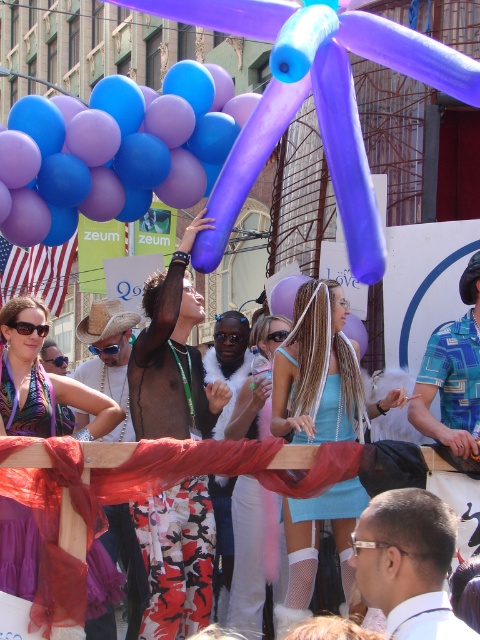
Does point (439, 547) come in front of point (476, 452)?

That is True.

The width and height of the screenshot is (480, 640). What are the coordinates of `smooth black hair at center` in the screenshot? It's located at (408, 563).

Can you confirm if floral-patterned shorts at center is positioned to the left of blue printed shirt at center?

Indeed, floral-patterned shorts at center is positioned on the left side of blue printed shirt at center.

Is point (144, 420) positioned behind point (466, 342)?

Yes, it is behind point (466, 342).

Identify the location of floral-patterned shorts at center. (172, 355).

Does lavender rubber balloon at upper center appear on the right side of purple chiffon scarf at upper left?

In fact, lavender rubber balloon at upper center is to the left of purple chiffon scarf at upper left.

The width and height of the screenshot is (480, 640). Describe the element at coordinates (113, 150) in the screenshot. I see `lavender rubber balloon at upper center` at that location.

The width and height of the screenshot is (480, 640). In order to click on lavender rubber balloon at upper center in this screenshot , I will do [x=113, y=150].

Locate an element on the screen. The height and width of the screenshot is (640, 480). lavender rubber balloon at upper center is located at coordinates (113, 150).